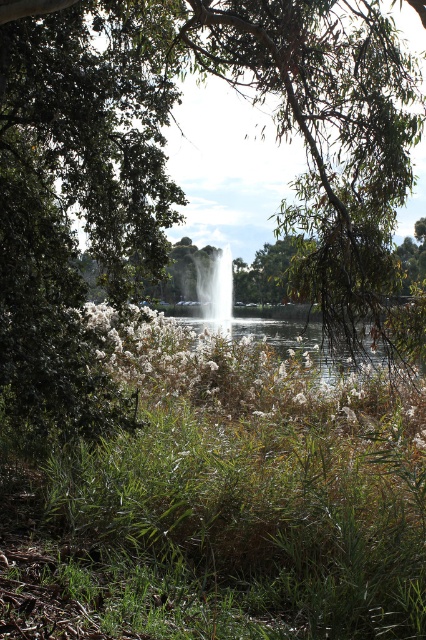
From the picture: Who is higher up, green leafy tree at center or white glossy fountain at center?

green leafy tree at center is higher up.

Can you confirm if green leafy tree at center is shorter than white glossy fountain at center?

Yes.

Is point (152, 44) more distant than point (195, 259)?

No.

At what (x,y) coordinates should I click in order to perform the action: click on green leafy tree at center. Please return your answer as a coordinate pair (x, y). This screenshot has height=640, width=426. Looking at the image, I should click on click(x=164, y=163).

Can you confirm if green leafy tree at center is taller than green leafy tree at left?

In fact, green leafy tree at center may be shorter than green leafy tree at left.

Which is behind, point (374, 68) or point (161, 16)?

The point (161, 16) is more distant.

Does point (152, 260) come farther from viewer compared to point (60, 182)?

No, it is not.

This screenshot has height=640, width=426. What are the coordinates of `green leafy tree at center` in the screenshot? It's located at (x=164, y=163).

Identify the location of green leafy tree at left. (77, 198).

Which is behind, point (42, 221) or point (201, 282)?

Point (201, 282)

Between point (115, 403) and point (227, 282), which one is positioned behind?

Positioned behind is point (227, 282).

At what (x,y) coordinates should I click in order to perform the action: click on green leafy tree at left. Please return your answer as a coordinate pair (x, y). Looking at the image, I should click on tap(77, 198).